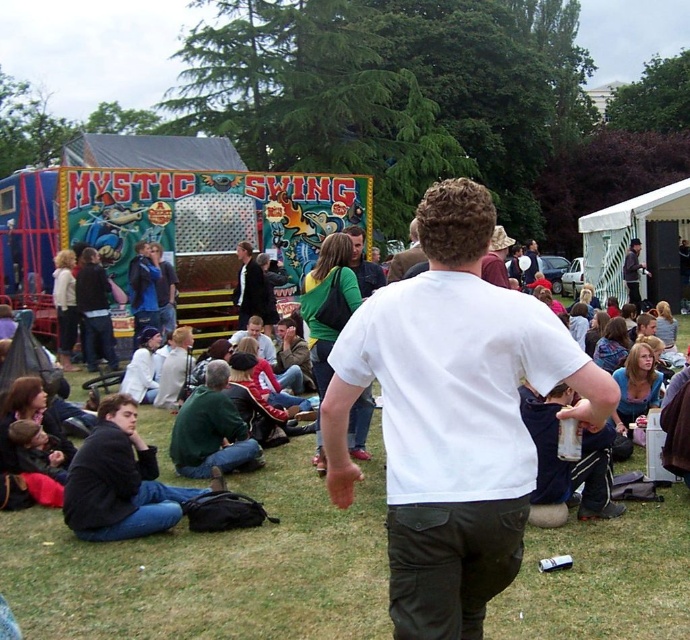
Question: Is white matte t-shirt at center closer to the viewer compared to dark gray hoodie at center?

Choices:
 (A) no
 (B) yes

Answer: (B)

Question: Can you confirm if green grass at center is wider than white matte t-shirt at center?

Choices:
 (A) no
 (B) yes

Answer: (B)

Question: Can you confirm if white matte t-shirt at center is positioned to the right of green matte shirt at center?

Choices:
 (A) no
 (B) yes

Answer: (B)

Question: Considering the real-world distances, which object is closest to the white matte t-shirt at center?

Choices:
 (A) green grass at center
 (B) dark gray hoodie at center

Answer: (A)

Question: Which object is the closest to the green grass at center?

Choices:
 (A) dark gray hoodie at center
 (B) white matte t-shirt at center
 (C) dark green sweater at lower left
 (D) green matte shirt at center

Answer: (C)

Question: Which of the following is the farthest from the observer?

Choices:
 (A) green grass at center
 (B) green matte shirt at center
 (C) white matte t-shirt at center
 (D) dark gray hoodie at center

Answer: (D)